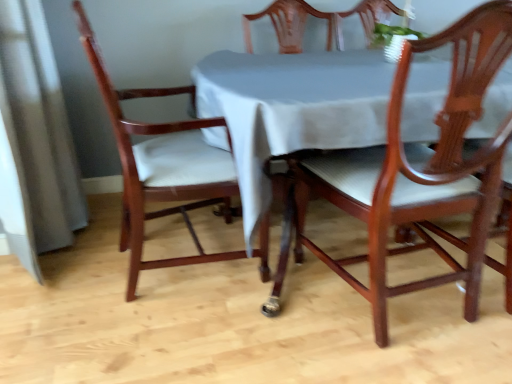
Question: Relative to mahogany wood chair at center, acting as the 1th chair starting from the right, is mahogany wood chair at left, which is the second chair in right-to-left order, in front or behind?

Choices:
 (A) behind
 (B) front

Answer: (A)

Question: Based on their sizes in the image, would you say mahogany wood chair at left, which is counted as the 1th chair, starting from the left, is bigger or smaller than mahogany wood chair at center, acting as the 1th chair starting from the right?

Choices:
 (A) big
 (B) small

Answer: (A)

Question: Is mahogany wood chair at left, which is the second chair in right-to-left order, taller or shorter than mahogany wood chair at center, the 2th chair when ordered from left to right?

Choices:
 (A) short
 (B) tall

Answer: (B)

Question: Choose the correct answer: Is mahogany wood chair at center, the 2th chair when ordered from left to right, inside mahogany wood chair at left, which is the second chair in right-to-left order, or outside it?

Choices:
 (A) inside
 (B) outside

Answer: (B)

Question: Considering their positions, is mahogany wood chair at center, the 2th chair when ordered from left to right, located in front of or behind mahogany wood chair at left, which is counted as the 1th chair, starting from the left?

Choices:
 (A) behind
 (B) front

Answer: (B)

Question: Looking at their shapes, would you say mahogany wood chair at center, the 2th chair when ordered from left to right, is wider or thinner than mahogany wood chair at left, which is the second chair in right-to-left order?

Choices:
 (A) wide
 (B) thin

Answer: (B)

Question: In terms of height, does mahogany wood chair at center, acting as the 1th chair starting from the right, look taller or shorter compared to mahogany wood chair at left, which is counted as the 1th chair, starting from the left?

Choices:
 (A) short
 (B) tall

Answer: (A)